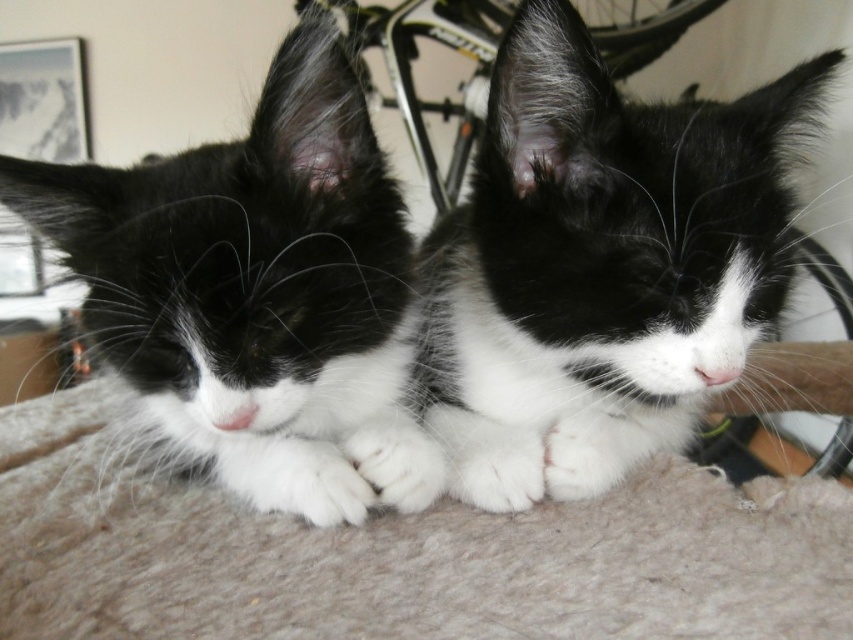
Is point (639, 440) positioned behind point (251, 157)?

Yes, point (639, 440) is behind point (251, 157).

Describe the element at coordinates (599, 266) in the screenshot. I see `black and white fur at center` at that location.

Which is behind, point (581, 51) or point (294, 296)?

Positioned behind is point (581, 51).

At what (x,y) coordinates should I click in order to perform the action: click on black and white fur at center. Please return your answer as a coordinate pair (x, y). The height and width of the screenshot is (640, 853). Looking at the image, I should click on (599, 266).